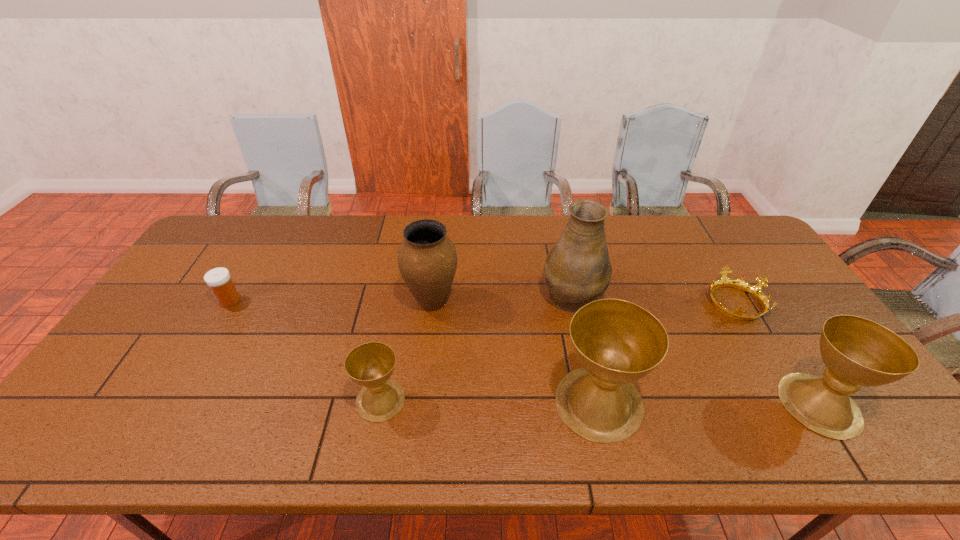
You are a GUI agent. You are given a task and a screenshot of the screen. Output one action in this format:
    pyautogui.click(x=<x>, y=<y>)
    Task: Click on the free location located 0.250m on the back of the leftmost chalice
    The image size is (960, 540).
    Given the screenshot: What is the action you would take?
    pyautogui.click(x=398, y=308)

You are a GUI agent. You are given a task and a screenshot of the screen. Output one action in this format:
    pyautogui.click(x=<x>, y=<y>)
    Task: Click on the vacant space located on the right of the second chalice from right to left
    Image resolution: width=960 pixels, height=540 pixels.
    Given the screenshot: What is the action you would take?
    click(x=691, y=402)

Where is `vacant space situated 0.280m on the back of the rightmost chalice`? vacant space situated 0.280m on the back of the rightmost chalice is located at coordinates (750, 296).

You are a GUI agent. You are given a task and a screenshot of the screen. Output one action in this format:
    pyautogui.click(x=<x>, y=<y>)
    Task: Click on the free space located 0.050m on the right of the shortest object
    The image size is (960, 540).
    Given the screenshot: What is the action you would take?
    pyautogui.click(x=780, y=302)

The height and width of the screenshot is (540, 960). I want to click on free spot located 0.050m on the handle side of the tallest object, so click(564, 260).

What are the coordinates of `vacant space located on the handle side of the tallest object` in the screenshot? It's located at (555, 219).

Locate an element on the screen. This screenshot has height=540, width=960. free space located on the handle side of the tallest object is located at coordinates (556, 222).

The image size is (960, 540). Find the location of `vacant region located 0.380m on the left of the urn`. vacant region located 0.380m on the left of the urn is located at coordinates (276, 302).

Locate an element on the screen. free space located on the front of the medicine is located at coordinates (211, 332).

I want to click on chalice positioned at the right edge, so click(x=857, y=352).